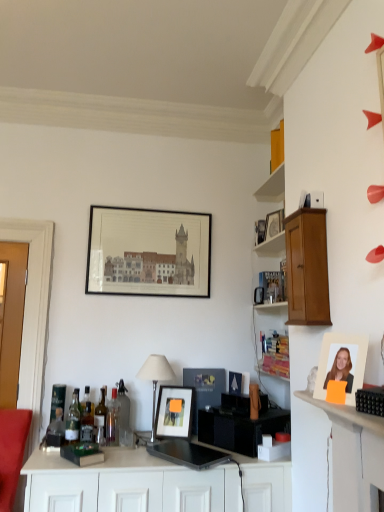
Question: From a real-world perspective, is wooden cabinet at upper right above or below light brown wood cabinet at upper right?

Choices:
 (A) above
 (B) below

Answer: (A)

Question: In the image, is wooden cabinet at upper right positioned in front of or behind light brown wood cabinet at upper right?

Choices:
 (A) behind
 (B) front

Answer: (A)

Question: Estimate the real-world distances between objects in this image. Which object is farther from the matte black picture frame at center, placed as the third picture frame when sorted from top to bottom?

Choices:
 (A) clear glass bottle at center, the 7th bottle in the left-to-right sequence
 (B) silver metallic table lamp at center
 (C) green glass bottle at left, the 7th bottle viewed from the right
 (D) matte black picture frame at upper center, positioned as the fourth picture frame in right-to-left order
 (E) wooden cabinet at upper right

Answer: (C)

Question: Which is farther from the translucent glass bottle at left, positioned as the sixth bottle in right-to-left order?

Choices:
 (A) matte black picture frame at center, which is counted as the 4th picture frame, starting from the top
 (B) wooden cabinet at upper right
 (C) matte wooden picture frame at right, acting as the 1th picture frame starting from the right
 (D) matte black picture frame at center, the 3th picture frame from the back
 (E) matte black picture frame at upper center, the 4th picture frame viewed from the front

Answer: (C)